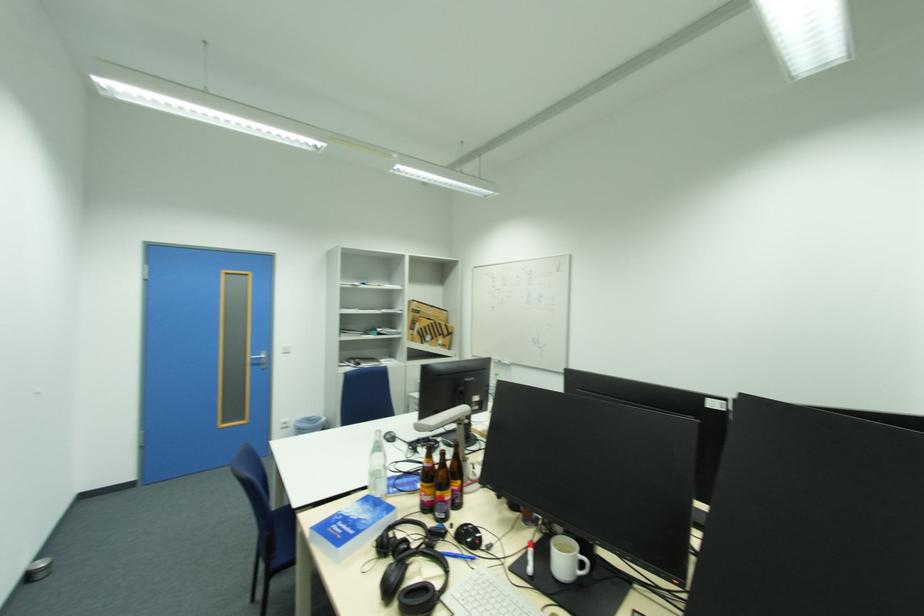
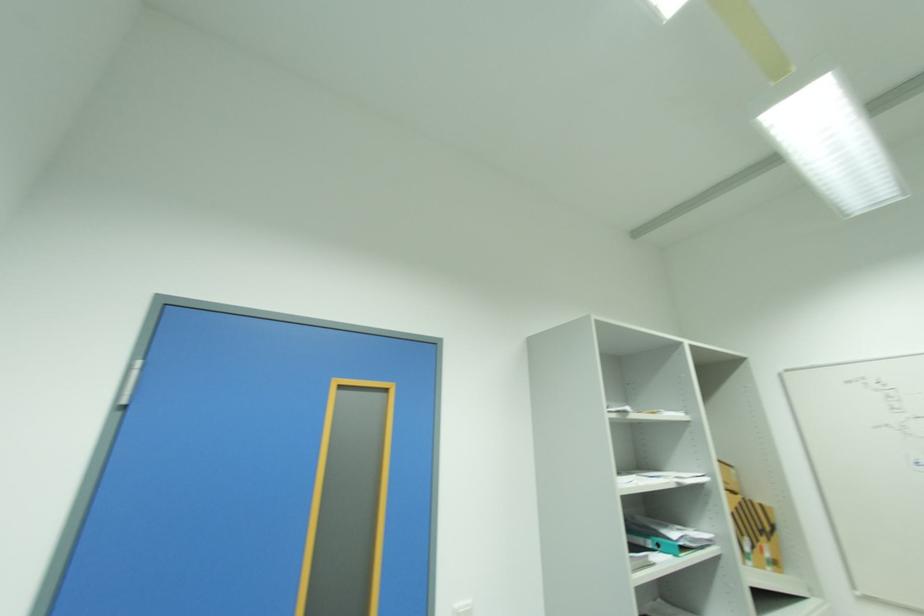
Question: I am providing you with two images of the same scene from different viewpoints. Please identify which objects are invisible in image2.

Choices:
 (A) cardboard box
 (B) blue binder
 (C) white light switch
 (D) none of these

Answer: (D)